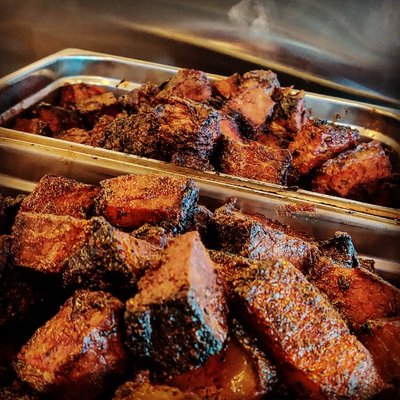
You are a GUI agent. You are given a task and a screenshot of the screen. Output one action in this format:
    pyautogui.click(x=<x>, y=<y>)
    Task: Click on the edge of tray
    
    Given the screenshot: What is the action you would take?
    pyautogui.click(x=68, y=53)